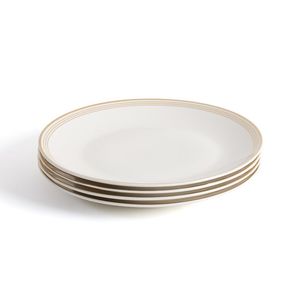
Identify the location of plates. The height and width of the screenshot is (300, 300). (132, 207), (140, 200), (151, 193), (165, 185).